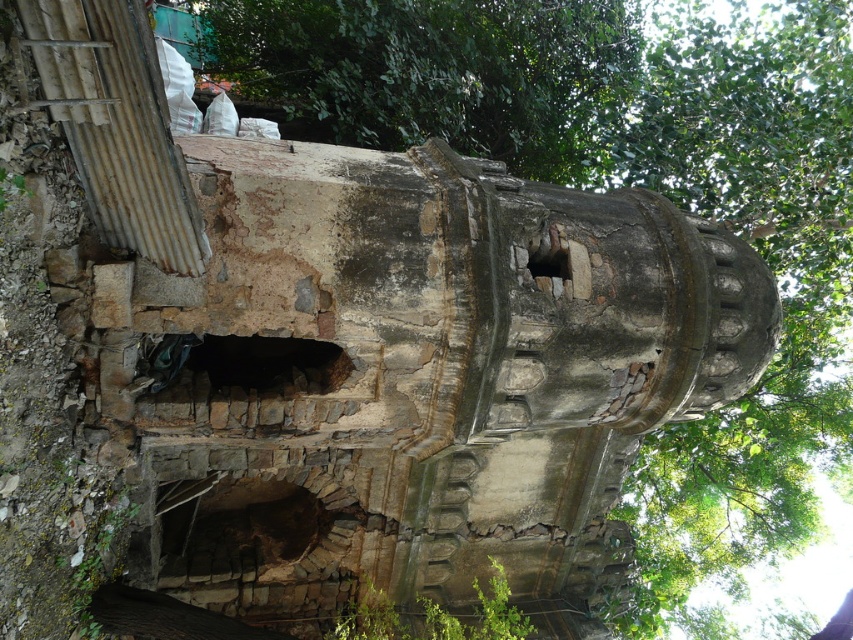
Is point (248, 531) in front of point (534, 260)?

No.

Is point (289, 557) farther from camera compared to point (569, 268)?

Yes, point (289, 557) is farther from viewer.

Identify the location of brown stone hole at lower left. (241, 531).

Is point (263, 508) less distant than point (267, 388)?

No, (263, 508) is further to viewer.

Is brown stone hole at lower left bigger than dark stone hole at center?

Yes, brown stone hole at lower left is bigger than dark stone hole at center.

What do you see at coordinates (241, 531) in the screenshot?
I see `brown stone hole at lower left` at bounding box center [241, 531].

Where is `brown stone hole at lower left`? The height and width of the screenshot is (640, 853). brown stone hole at lower left is located at coordinates (241, 531).

Based on the photo, can you confirm if dark stone hole at center is positioned to the right of rusty metal hole at center?

Incorrect, dark stone hole at center is not on the right side of rusty metal hole at center.

Does point (241, 339) come farther from viewer compared to point (553, 273)?

Yes, point (241, 339) is farther from viewer.

Does point (259, 356) come behind point (554, 252)?

That is True.

Locate an element on the screen. The image size is (853, 640). dark stone hole at center is located at coordinates (270, 362).